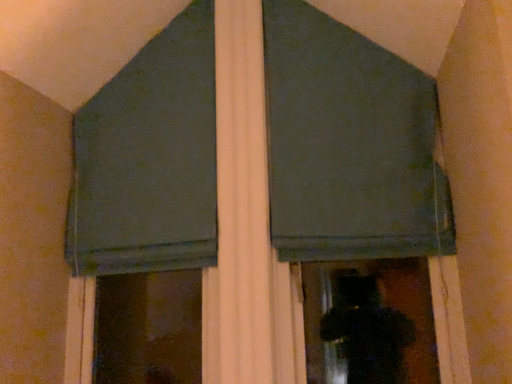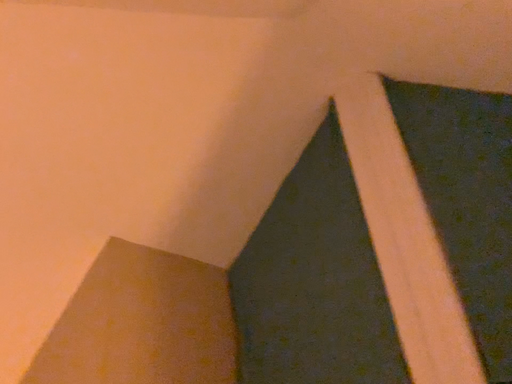
Question: How did the camera likely rotate when shooting the video?

Choices:
 (A) rotated upward
 (B) rotated downward

Answer: (A)